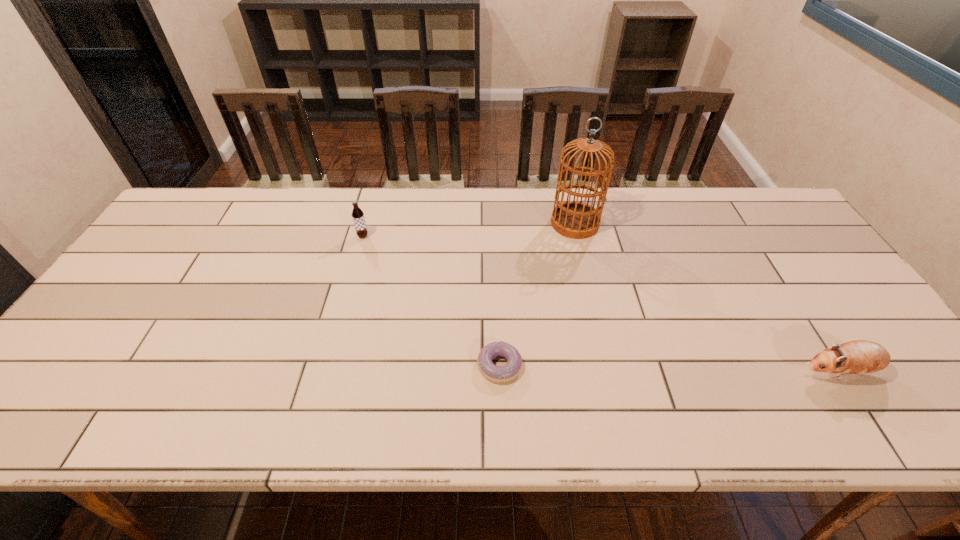
I want to click on the second closest object relative to the second object from right to left, so click(x=856, y=357).

Locate an element on the screen. The height and width of the screenshot is (540, 960). object that ranks as the closest to the birdcage is located at coordinates (499, 374).